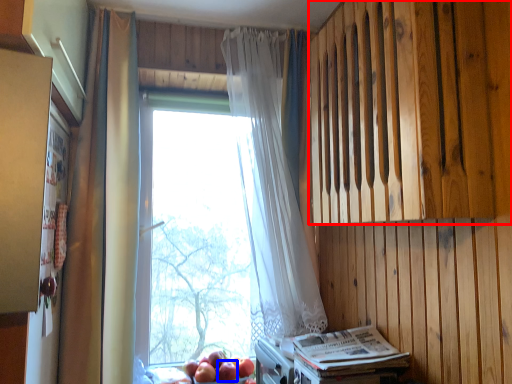
Question: Which of the following is the closest to the observer, wood (highlighted by a red box) or apple (highlighted by a blue box)?

Choices:
 (A) wood
 (B) apple

Answer: (A)